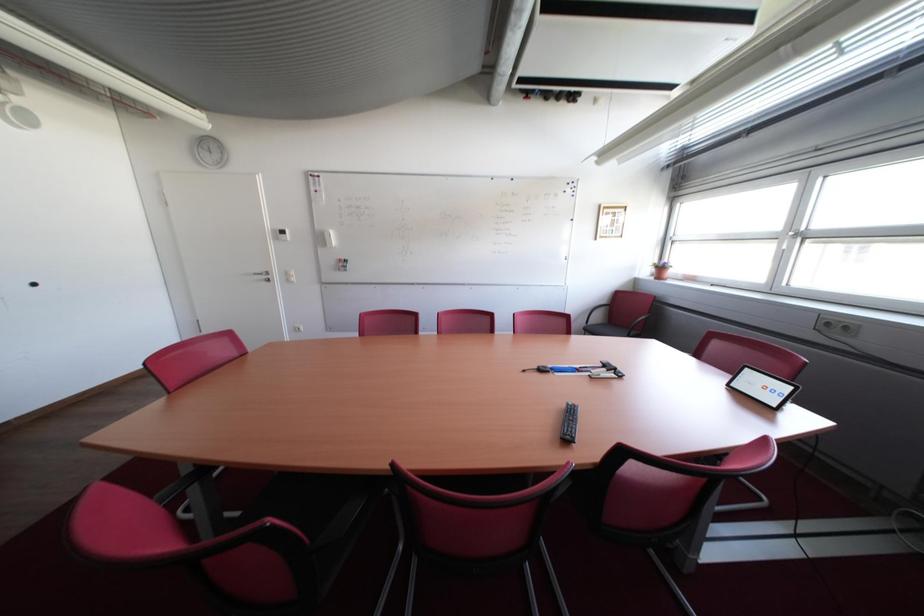
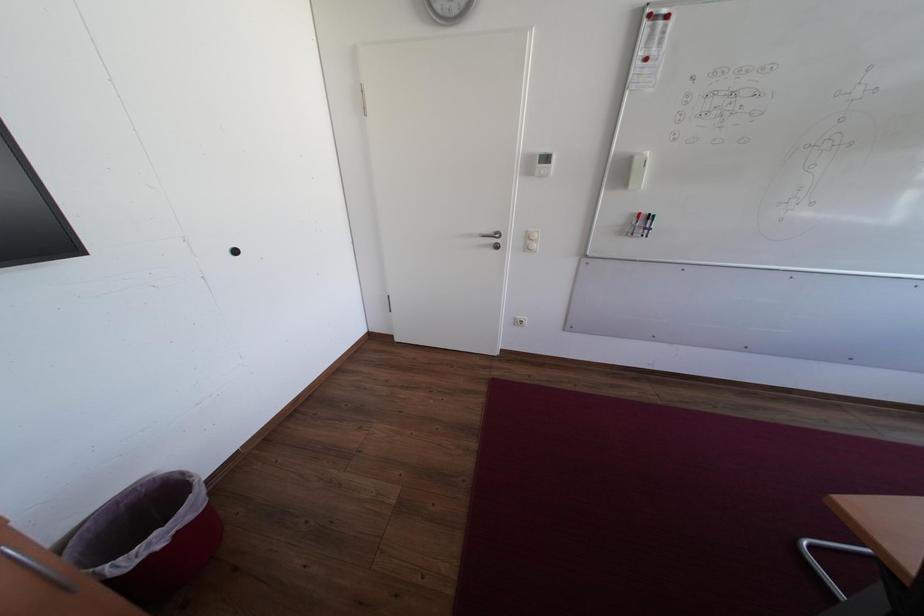
The images are taken continuously from a first-person perspective. In which direction are you moving?

The cameraman moved toward left, forward.